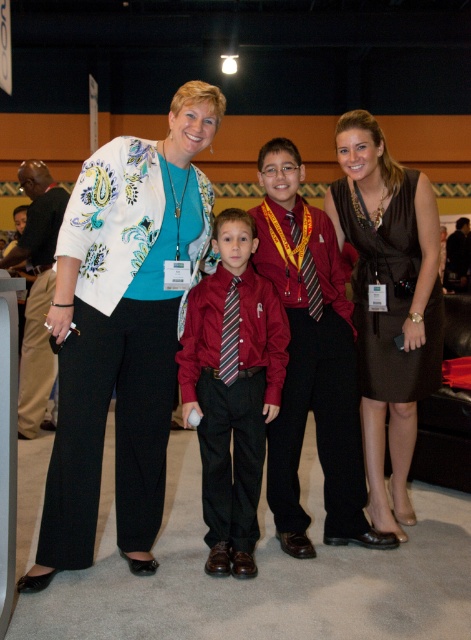
Is brown satin dress at right positioned at the back of matte red shirt at center?

Yes, brown satin dress at right is behind matte red shirt at center.

Is brown satin dress at right below matte red shirt at center?

No, brown satin dress at right is not below matte red shirt at center.

Between point (396, 211) and point (248, 440), which one is positioned in front?

Point (248, 440) is in front.

The image size is (471, 640). I want to click on brown satin dress at right, so click(x=389, y=301).

Which is below, matte red shirt at center or khaki pants at center?

matte red shirt at center

Which is more to the right, matte red shirt at center or khaki pants at center?

Positioned to the right is matte red shirt at center.

Locate an element on the screen. matte red shirt at center is located at coordinates (233, 388).

Does white floral blazer at center come in front of khaki pants at center?

Yes.

Identify the location of white floral blazer at center. (122, 330).